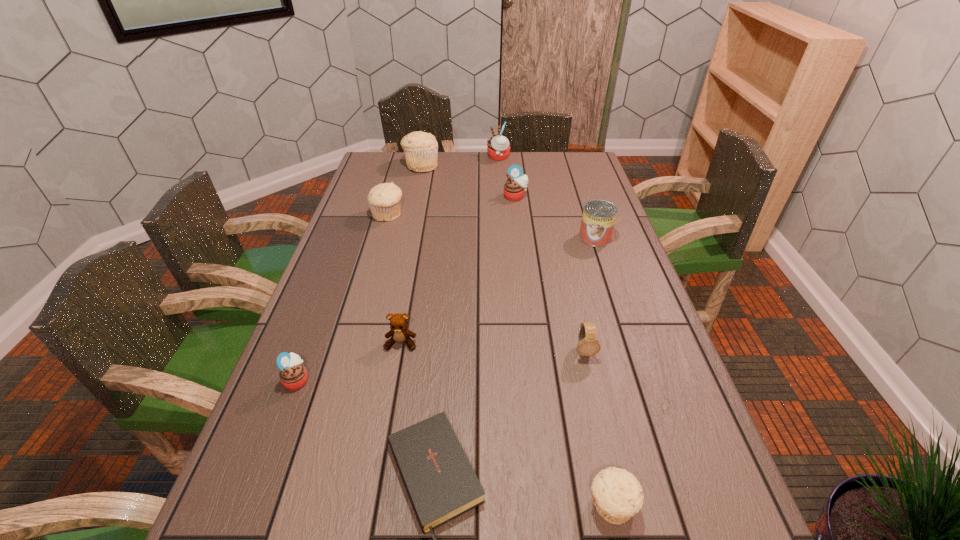
Identify the location of the farthest pink muffin. Image resolution: width=960 pixels, height=540 pixels. (498, 147).

I want to click on the farthest beige muffin, so click(x=421, y=149).

This screenshot has width=960, height=540. I want to click on the second farthest pink muffin, so click(x=516, y=185).

Identify the location of the third farthest muffin. This screenshot has height=540, width=960. (516, 185).

You are a GUI agent. You are given a task and a screenshot of the screen. Output one action in this format:
    pyautogui.click(x=<x>, y=<y>)
    Task: Click on the second farthest beige muffin
    The height and width of the screenshot is (540, 960).
    Given the screenshot: What is the action you would take?
    pyautogui.click(x=384, y=199)

Locate an element on the screen. Image resolution: width=960 pixels, height=540 pixels. the fourth farthest muffin is located at coordinates (384, 199).

Locate an element on the screen. can is located at coordinates (599, 216).

Where is `the sixth nearest object`? the sixth nearest object is located at coordinates (599, 216).

I want to click on watch, so click(588, 345).

You are a GUI agent. You are given a task and a screenshot of the screen. Output one action in this format:
    pyautogui.click(x=<x>, y=<y>)
    Task: Click on the brown teddy bear
    
    Given the screenshot: What is the action you would take?
    pyautogui.click(x=399, y=333)